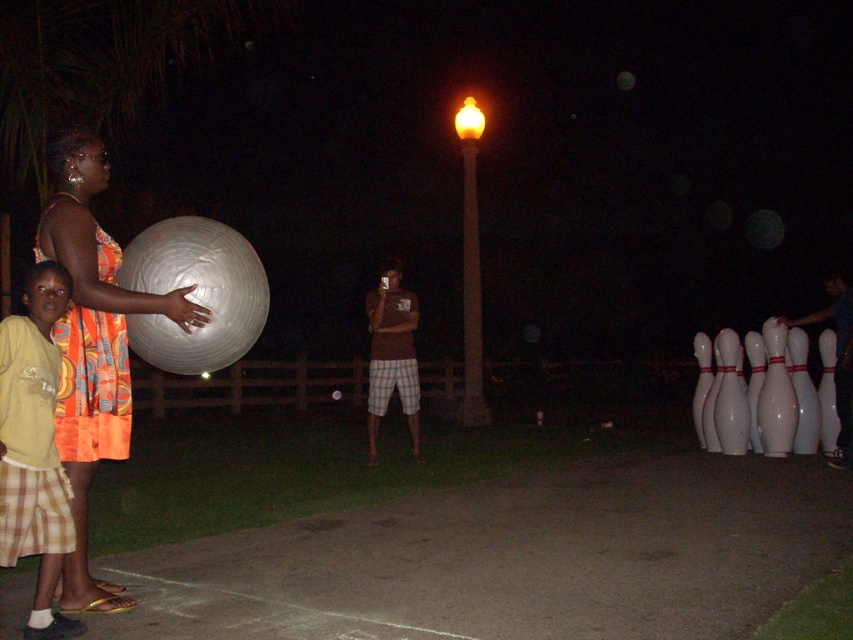
Question: Can you confirm if orange printed dress at left is positioned below orange printed fabric dress at left?

Choices:
 (A) yes
 (B) no

Answer: (A)

Question: Does yellow cotton shirt at left come in front of orange printed fabric dress at left?

Choices:
 (A) yes
 (B) no

Answer: (A)

Question: Which point is closer to the camera?

Choices:
 (A) (120, 385)
 (B) (57, 518)

Answer: (B)

Question: Can you confirm if yellow cotton shirt at left is positioned above orange printed fabric dress at left?

Choices:
 (A) yes
 (B) no

Answer: (B)

Question: Based on their relative distances, which object is nearer to the yellow cotton shirt at left?

Choices:
 (A) orange printed fabric dress at left
 (B) orange printed dress at left

Answer: (B)

Question: Estimate the real-world distances between objects in this image. Which object is closer to the yellow cotton shirt at left?

Choices:
 (A) orange printed fabric dress at left
 (B) orange printed dress at left

Answer: (B)